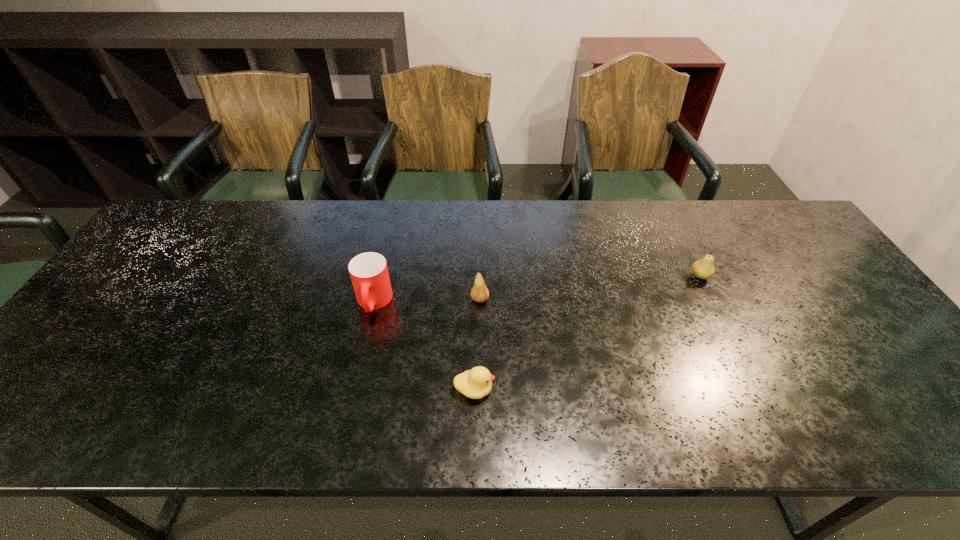
Image resolution: width=960 pixels, height=540 pixels. What are the coordinates of `empty location between the shortest object and the left pear` in the screenshot? It's located at pos(477,345).

Locate an element on the screen. empty space that is in between the nearest object and the right pear is located at coordinates (587, 333).

Find the location of a particular element. The width and height of the screenshot is (960, 540). free space that is in between the cup and the nearer pear is located at coordinates (427, 301).

The height and width of the screenshot is (540, 960). Identify the location of free point between the tallest object and the nearest object. (424, 346).

At what (x,y) coordinates should I click in order to perform the action: click on free space between the rightmost object and the left pear. Please return your answer as a coordinate pair (x, y). Looking at the image, I should click on (589, 288).

Identify the location of free space between the duckling and the farther pear. (587, 333).

At what (x,y) coordinates should I click in order to perform the action: click on the second closest object to the rightmost object. Please return your answer as a coordinate pair (x, y). Image resolution: width=960 pixels, height=540 pixels. Looking at the image, I should click on (476, 383).

Find the location of a particular element. This screenshot has height=540, width=960. object that can be found as the third closest to the duckling is located at coordinates 703,269.